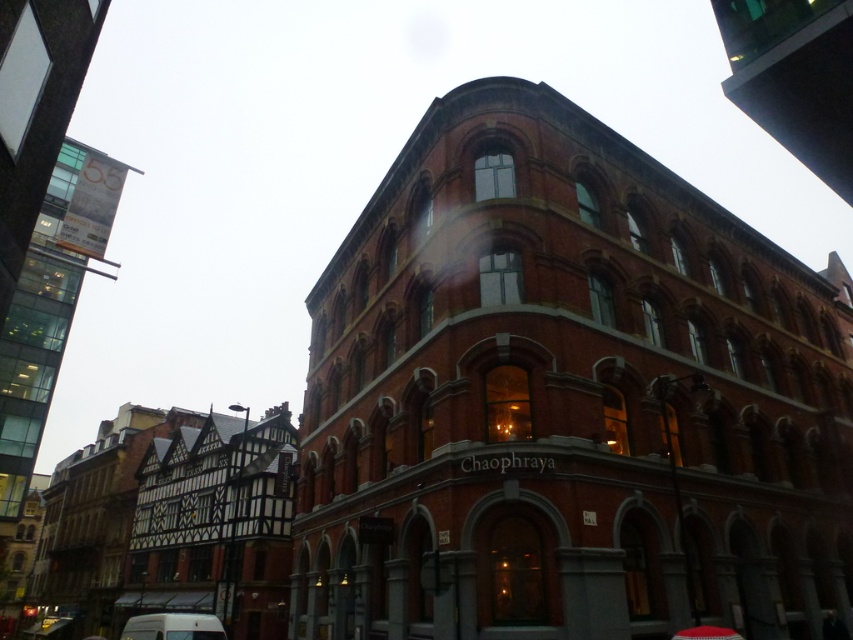
Does point (621, 360) come farther from viewer compared to point (206, 628)?

Yes, it is behind point (206, 628).

Does red brick building at center lie behind white matte van at lower left?

That is False.

Describe the element at coordinates (566, 397) in the screenshot. I see `red brick building at center` at that location.

Locate an element on the screen. The image size is (853, 640). red brick building at center is located at coordinates [x=566, y=397].